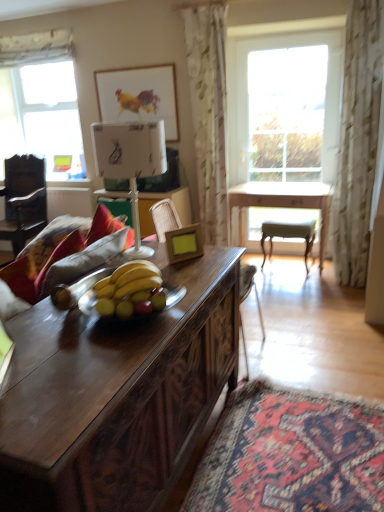
Where is `free location in front of wooden picture frame at center, which appears as the 2th picture frame when viewed from the top`? Image resolution: width=384 pixels, height=512 pixels. free location in front of wooden picture frame at center, which appears as the 2th picture frame when viewed from the top is located at coordinates (200, 265).